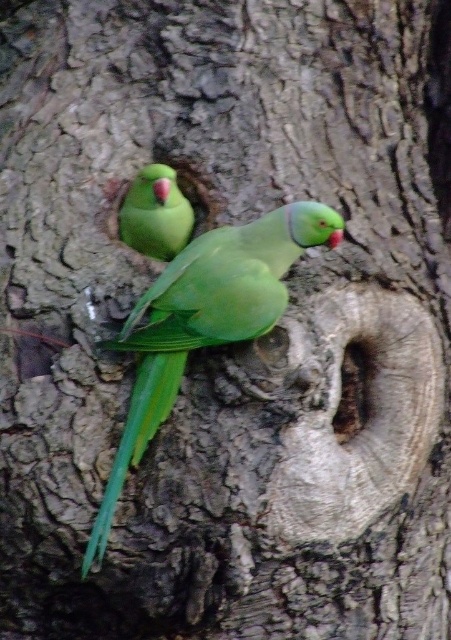
In the scene shown: Who is more distant from viewer, (219,308) or (164,166)?

Positioned behind is point (164,166).

Which of these two, green matte parrot at center or green matte parrot at upper left, stands shorter?

Standing shorter between the two is green matte parrot at upper left.

Between point (124, 461) and point (184, 227), which one is positioned in front?

Point (124, 461) is more forward.

Identify the location of green matte parrot at center. (205, 321).